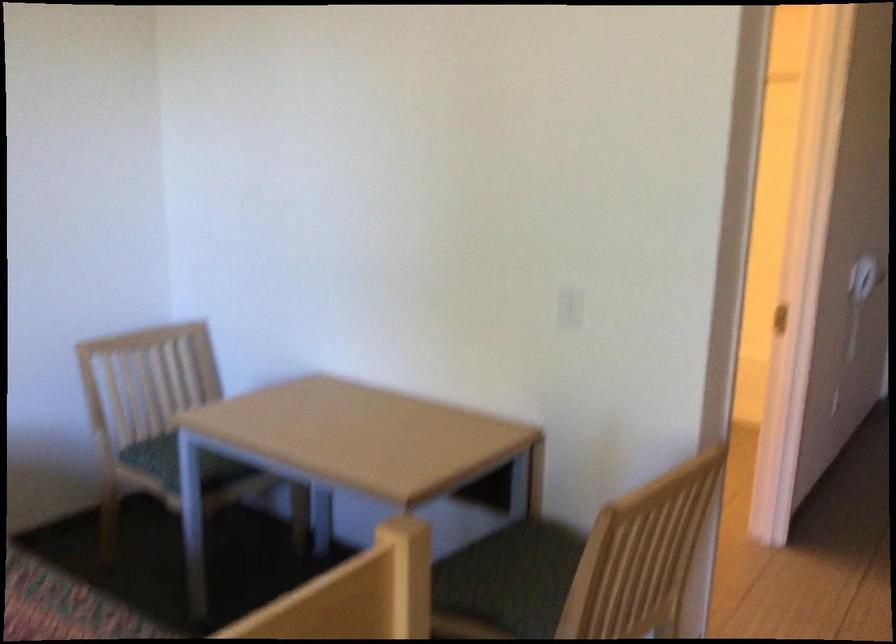
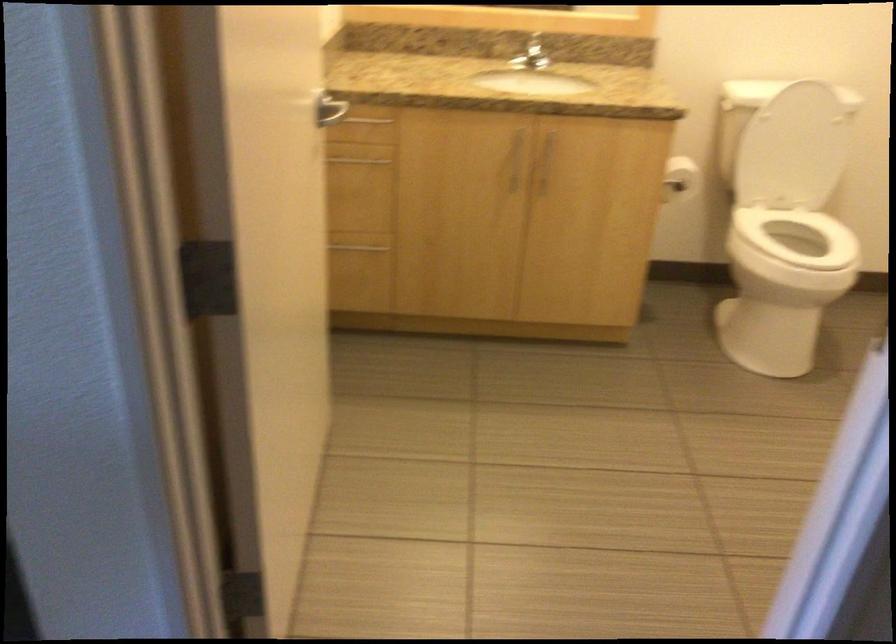
Question: I am providing you with two images of the same scene from different viewpoints. Please identify which objects are invisible in image2.

Choices:
 (A) checkered pillow
 (B) cabinet handle
 (C) white electrical outlet
 (D) toilet lid

Answer: (C)